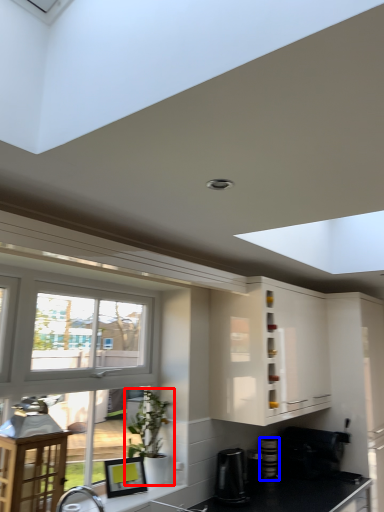
Question: Which object appears closest to the camera in this image, houseplant (highlighted by a red box) or appliance (highlighted by a blue box)?

Choices:
 (A) houseplant
 (B) appliance

Answer: (A)